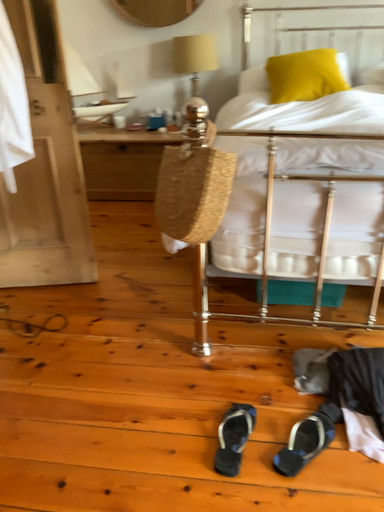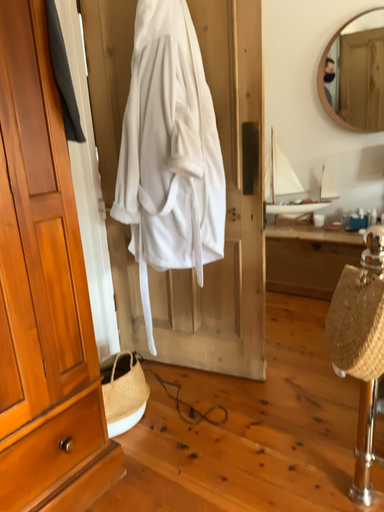
Question: Which way did the camera rotate in the video?

Choices:
 (A) rotated downward
 (B) rotated upward

Answer: (B)